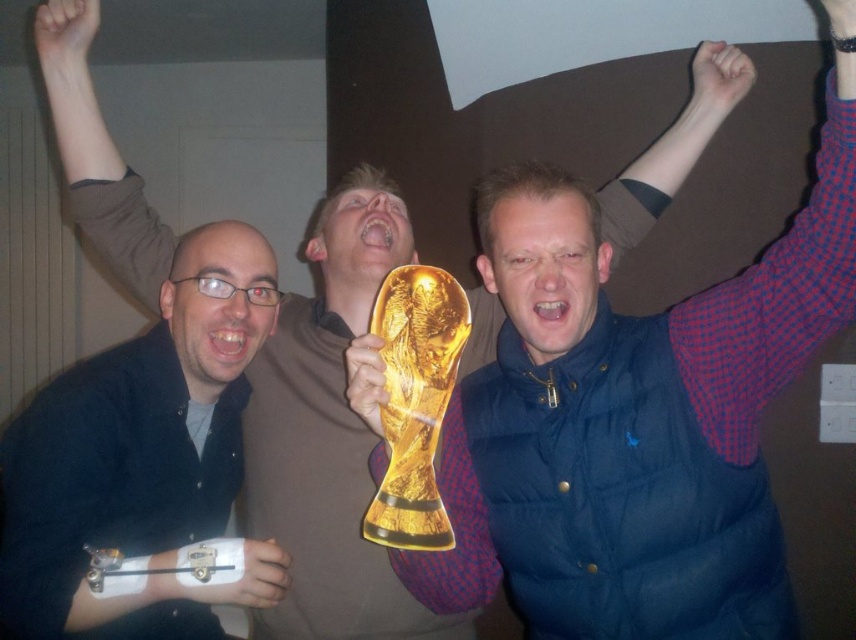
Does blue puffer vest at center have a larger size compared to matte black shirt at left?

Yes.

Is point (603, 328) positioned after point (63, 556)?

Yes.

Who is more forward, (690,596) or (210,572)?

Positioned in front is point (690,596).

Identify the location of blue puffer vest at center. This screenshot has width=856, height=640. (607, 454).